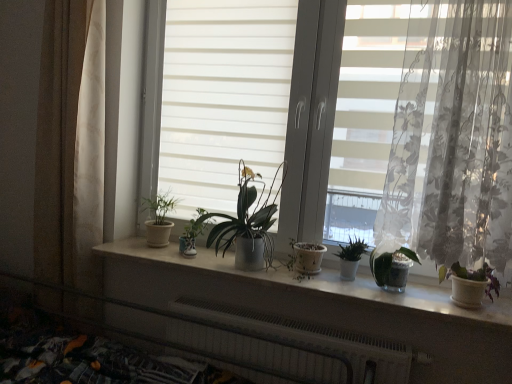
Locate an element on the screen. Image resolution: width=512 pixels, height=384 pixels. vacant space that's between green matte plant at center, which ranks as the 2th houseplant in left-to-right order, and matte white pot at center, which ranks as the third houseplant in left-to-right order is located at coordinates (181, 259).